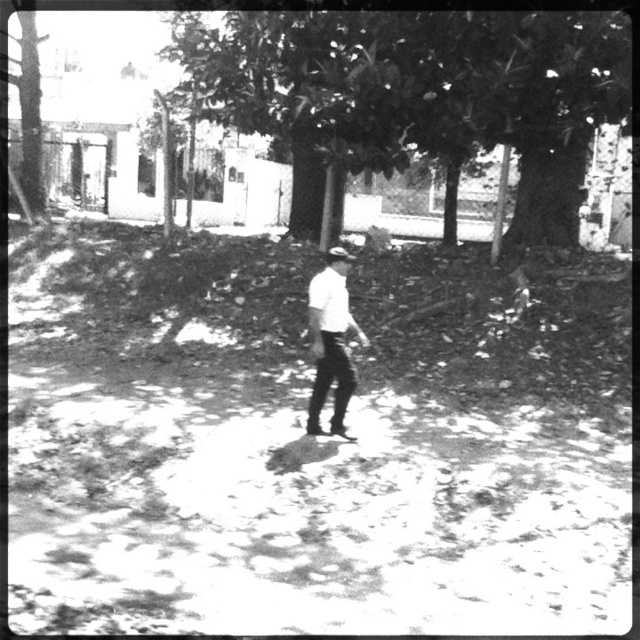
Question: In this image, where is smooth bark tree at center located relative to white matte shirt at center?

Choices:
 (A) left
 (B) right

Answer: (B)

Question: Which of the following is the farthest from the observer?

Choices:
 (A) smooth bark tree at center
 (B) white matte shirt at center

Answer: (A)

Question: Among these points, which one is farthest from the camera?

Choices:
 (A) (333, 275)
 (B) (579, 49)

Answer: (B)

Question: Can you confirm if smooth bark tree at center is positioned to the left of white matte shirt at center?

Choices:
 (A) no
 (B) yes

Answer: (A)

Question: Considering the relative positions of smooth bark tree at center and white matte shirt at center in the image provided, where is smooth bark tree at center located with respect to white matte shirt at center?

Choices:
 (A) left
 (B) right

Answer: (B)

Question: Among these points, which one is nearest to the camera?

Choices:
 (A) (404, 52)
 (B) (346, 390)

Answer: (B)